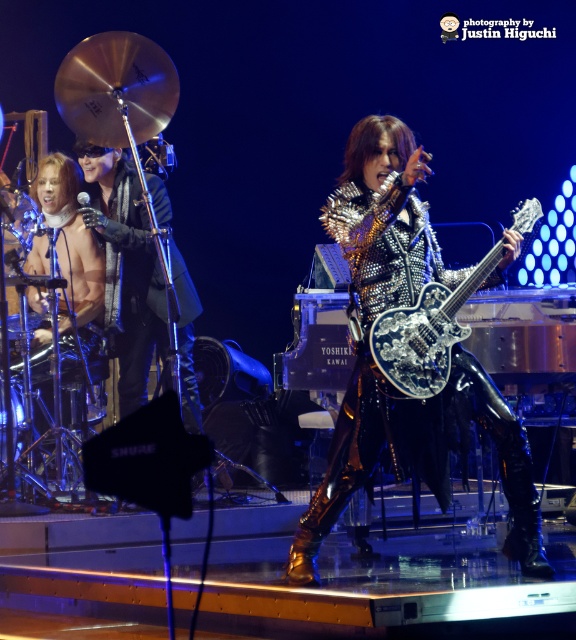
Who is more distant from viewer, [509,556] or [433,369]?

The point [509,556] is more distant.

Does point (365, 380) come behind point (434, 300)?

Yes, point (365, 380) is farther from viewer.

Locate an element on the screen. Image resolution: width=576 pixels, height=640 pixels. shiny metallic guitar at center is located at coordinates (376, 365).